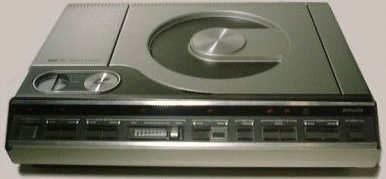
The image size is (386, 179). What are the coordinates of `table` in the screenshot? It's located at (366, 45).